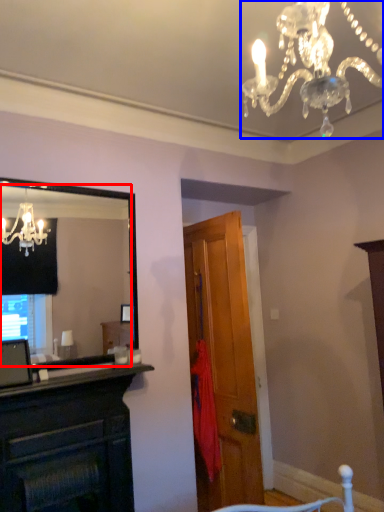
Question: Which of the following is the farthest to the observer, mirror (highlighted by a red box) or lamp (highlighted by a blue box)?

Choices:
 (A) mirror
 (B) lamp

Answer: (A)